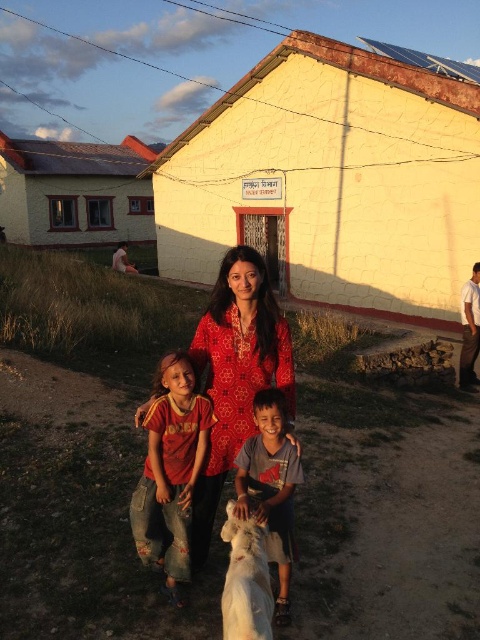
The width and height of the screenshot is (480, 640). I want to click on red floral dress at center, so click(237, 372).

What do you see at coordinates (237, 372) in the screenshot? Image resolution: width=480 pixels, height=640 pixels. I see `red floral dress at center` at bounding box center [237, 372].

The image size is (480, 640). Find the location of `red floral dress at center`. red floral dress at center is located at coordinates (237, 372).

Which of these two, red floral dress at center or light blue cotton shirt at center, stands taller?

With more height is red floral dress at center.

Who is more distant from viewer, (233, 296) or (237, 474)?

The point (233, 296) is more distant.

What are the coordinates of `red floral dress at center` in the screenshot? It's located at (237, 372).

Between matte red shirt at center and light blue cotton shirt at center, which one is positioned lower?

light blue cotton shirt at center is below.

How much distance is there between matte red shirt at center and light blue cotton shirt at center?

A distance of 17.40 inches exists between matte red shirt at center and light blue cotton shirt at center.

The image size is (480, 640). Describe the element at coordinates (170, 470) in the screenshot. I see `matte red shirt at center` at that location.

This screenshot has width=480, height=640. What are the coordinates of `matte red shirt at center` in the screenshot? It's located at (170, 470).